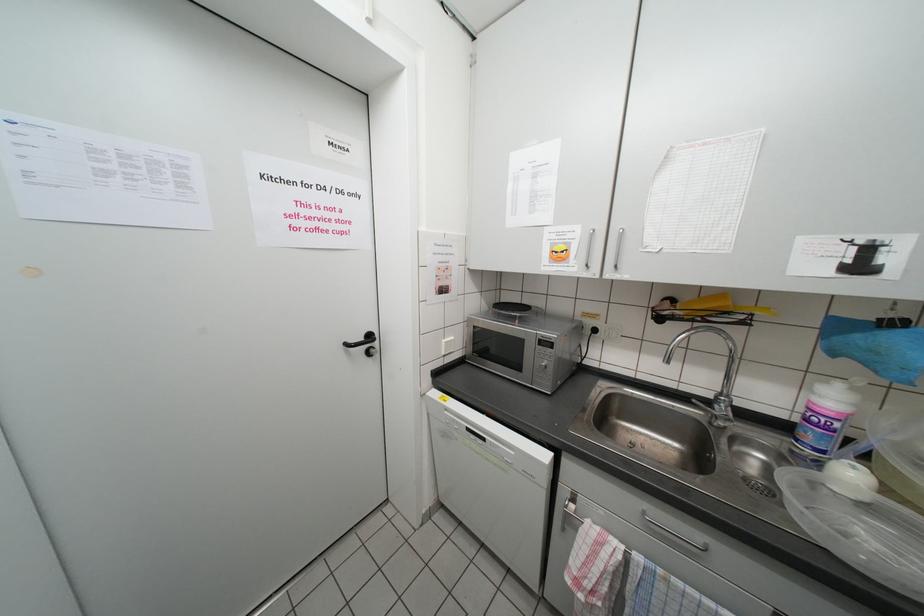
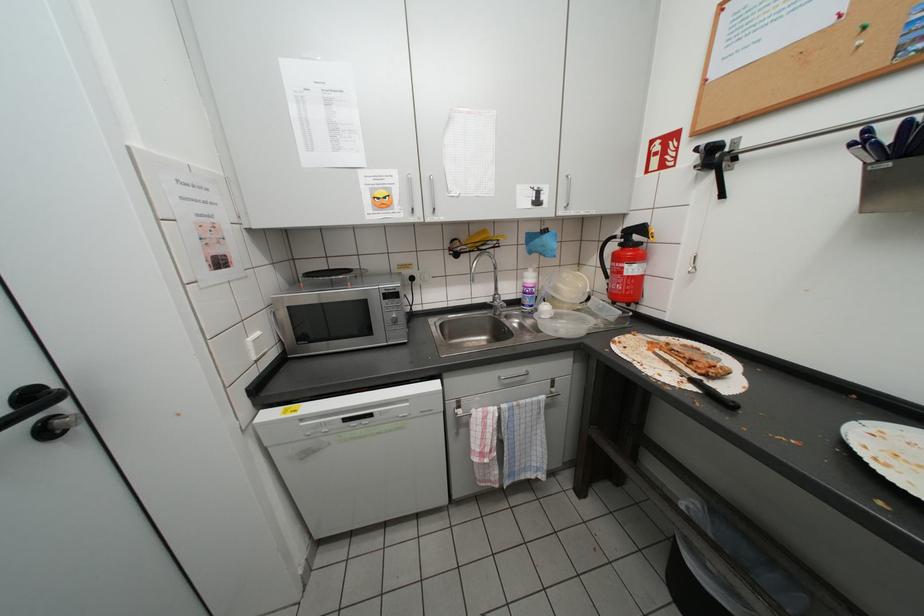
Question: The camera is either moving clockwise (left) or counter-clockwise (right) around the object. The first image is from the beginning of the video and the second image is from the end. Is the camera moving left or right when shooting the video?

Choices:
 (A) Left
 (B) Right

Answer: (A)